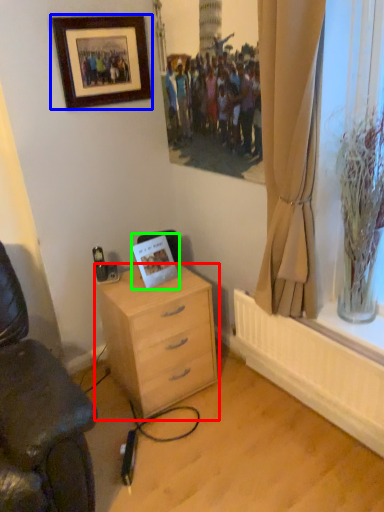
Question: Based on their relative distances, which object is nearer to desk (highlighted by a red box)? Choose from picture frame (highlighted by a blue box) and postcard (highlighted by a green box).

Choices:
 (A) picture frame
 (B) postcard

Answer: (B)